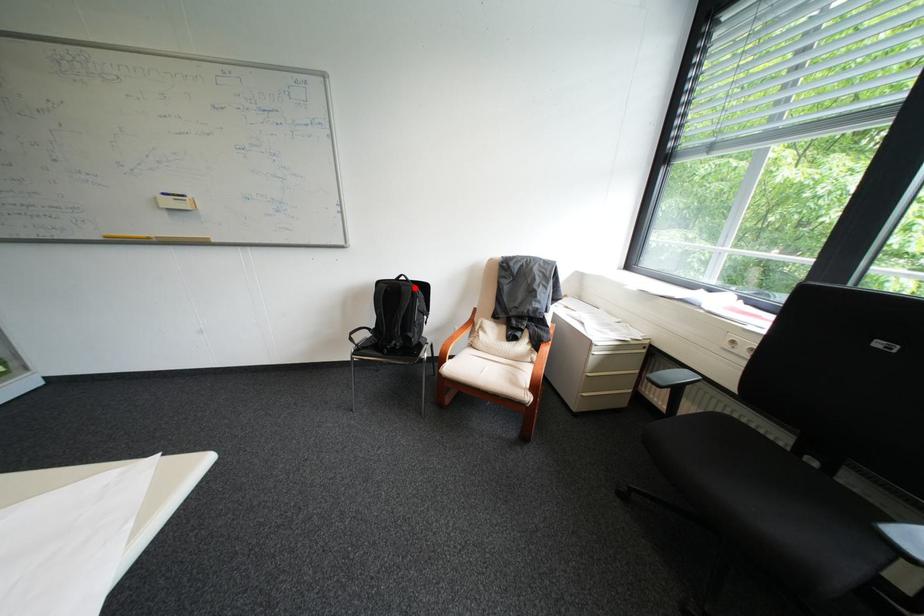
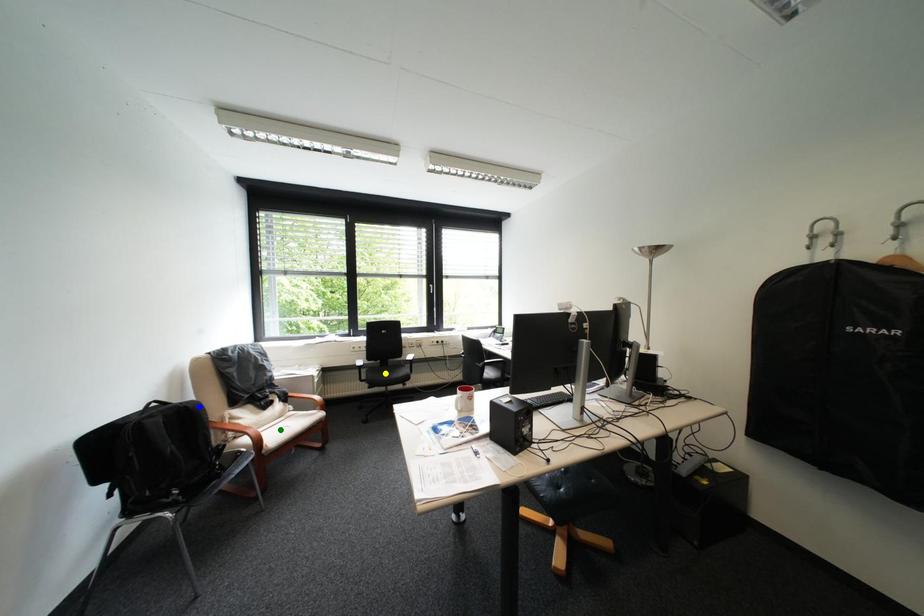
Question: I am providing you with two images of the same scene from different viewpoints. A red point is marked on the first image. You are given multiple points on the second image. In image 2, which mark is for the same physical point as the one in image 1?

Choices:
 (A) yellow point
 (B) blue point
 (C) green point

Answer: (B)